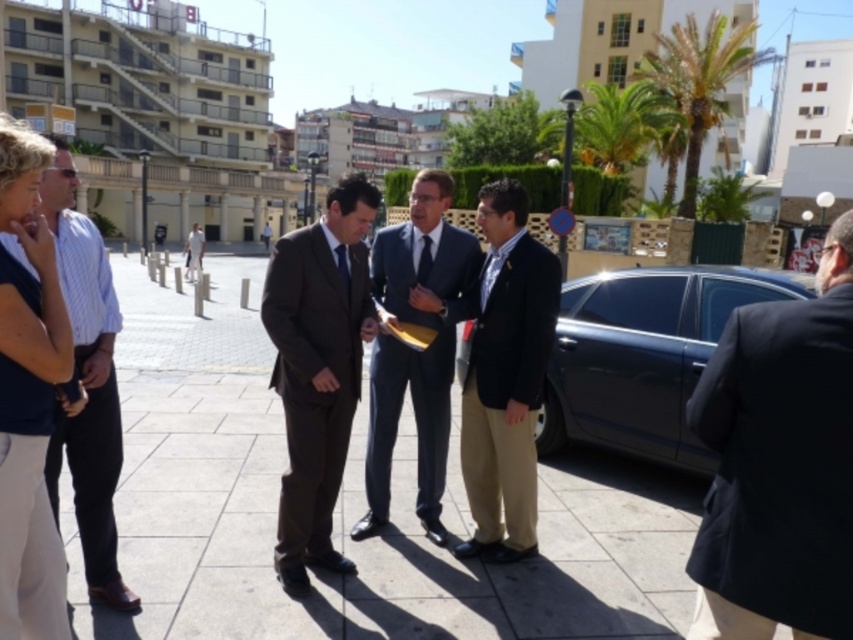
You are an observer standing in front of the group of men. Which of the two men, the one wearing the dark blue suit at right or the dark blue fabric shirt at left, appears shorter in height?

The dark blue suit at right appears shorter in height compared to the dark blue fabric shirt at left.

You are a photographer planning to take a group photo of the two men in the scene. The dark blue suit at right and the light blue striped fabric business suit at left are the subjects. Since you want to ensure that both subjects are framed properly, which of the two men should you position closer to the camera to maintain their proportional sizes in the photo?

The dark blue suit at right has a lesser width compared to the light blue striped fabric business suit at left. To maintain proportional sizes, position the dark blue suit at right closer to the camera since it is naturally narrower, ensuring both appear balanced in the photo.

Consider the image. You are a photographer positioned at the back of the scene. You need to take a photo of both the dark blue suit at right and the dark blue fabric shirt at left. Which one will appear larger in the photo?

The dark blue suit at right will appear larger in the photo because it is closer to the viewer than the dark blue fabric shirt at left.